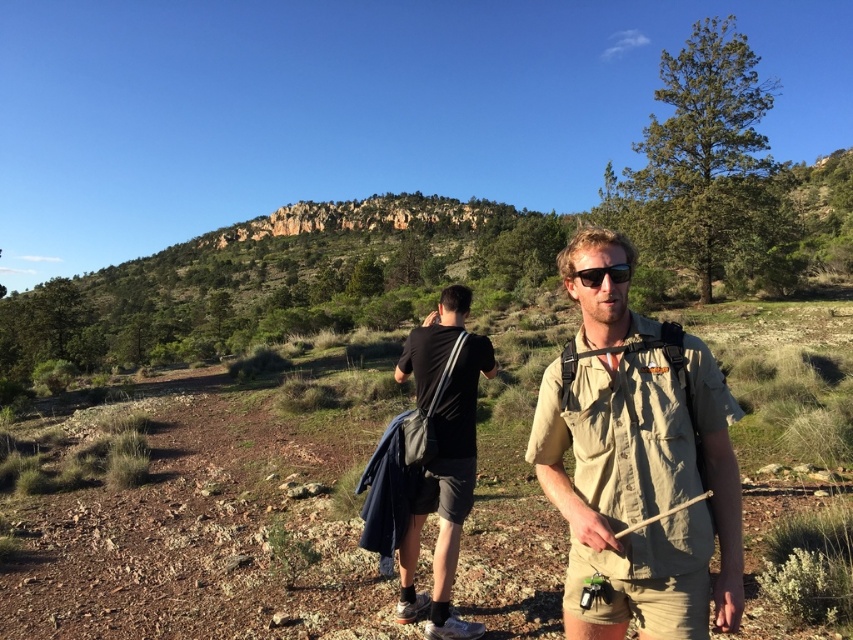
Question: Is black matte shirt at center to the left of matte black sunglasses at center from the viewer's perspective?

Choices:
 (A) no
 (B) yes

Answer: (B)

Question: Does tan canvas backpack at center appear over black matte shirt at center?

Choices:
 (A) yes
 (B) no

Answer: (A)

Question: Which point appears closest to the camera in this image?

Choices:
 (A) (459, 454)
 (B) (590, 410)

Answer: (B)

Question: Based on their relative distances, which object is nearer to the matte black sunglasses at center?

Choices:
 (A) black matte shirt at center
 (B) tan canvas backpack at center

Answer: (B)

Question: Does black matte shirt at center come behind matte black sunglasses at center?

Choices:
 (A) yes
 (B) no

Answer: (A)

Question: Which of the following is the closest to the observer?

Choices:
 (A) matte black sunglasses at center
 (B) tan canvas backpack at center

Answer: (B)